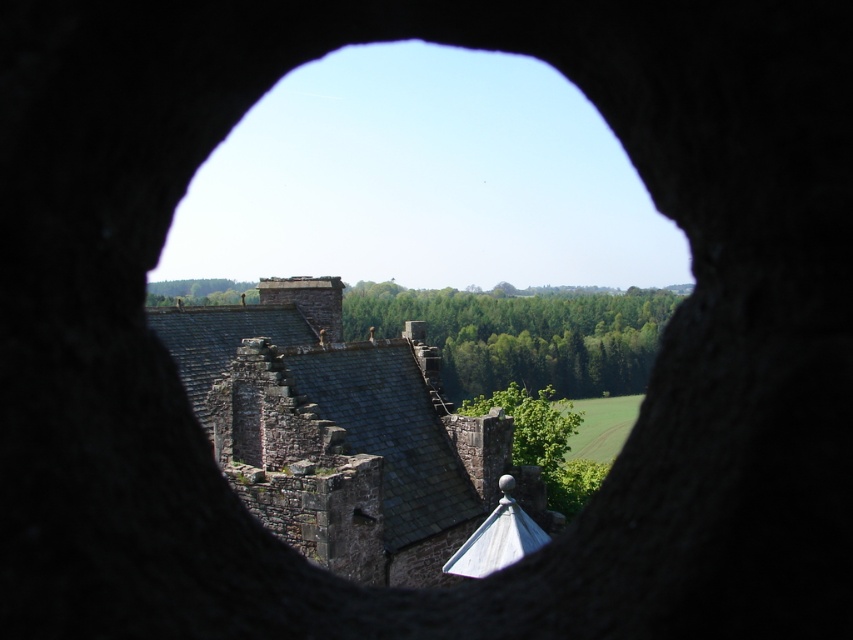
In the scene shown: You are standing outside the circular stone window and want to know if the dark gray stone castle at center is visible above the green leafy trees at center. Based on their heights, can you determine this?

The dark gray stone castle at center is shorter than the green leafy trees at center, so it is not visible above them.

You are an architect examining the structure of the smooth stone window at center and the dark gray stone castle at center. Which structure is located higher in the image?

The smooth stone window at center is positioned over the dark gray stone castle at center, so it is higher in the image.